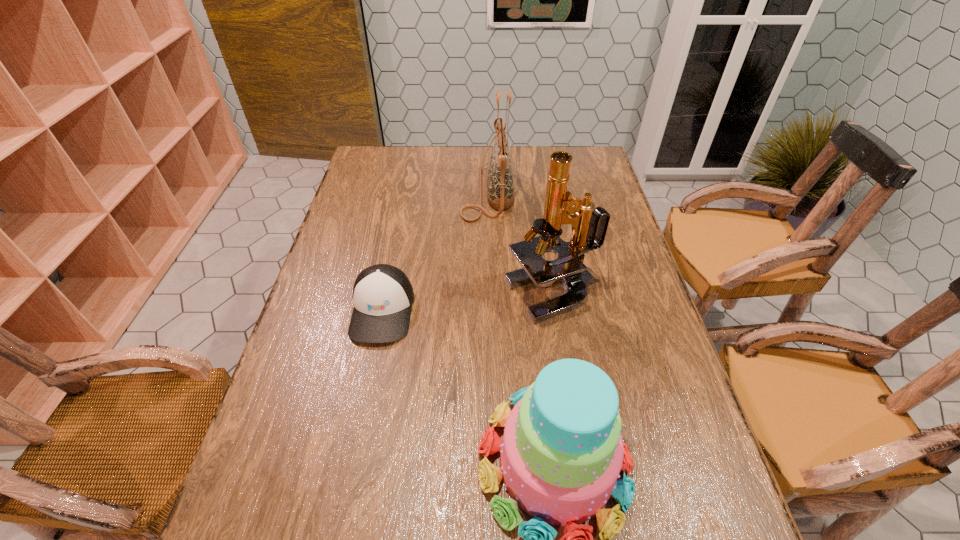
Find the location of a particular element. Image resolution: width=960 pixels, height=540 pixels. free space that satisfies the following two spatial constraints: 1. at the eyepiece of the tallest object; 2. on the front panel of the shortest object is located at coordinates (558, 310).